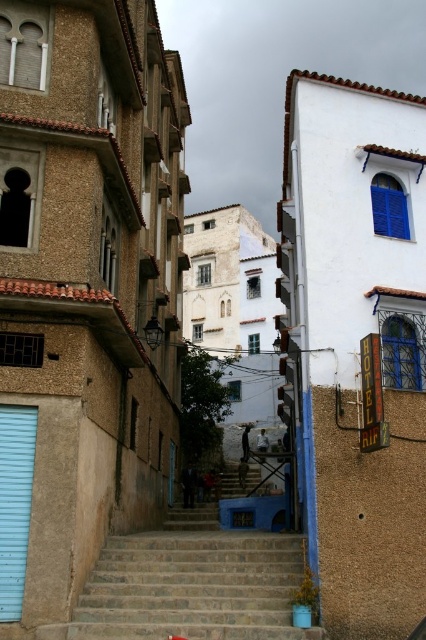
Question: Where is brown stone stairs at center located in relation to light blue matte garage door at lower left in the image?

Choices:
 (A) left
 (B) right

Answer: (B)

Question: Can you confirm if brown stone stairs at center is bigger than light blue matte garage door at lower left?

Choices:
 (A) no
 (B) yes

Answer: (B)

Question: Which object is farther from the camera taking this photo?

Choices:
 (A) brown stone stairs at center
 (B) light blue matte garage door at lower left

Answer: (B)

Question: Can you confirm if brown stone stairs at center is positioned above light blue matte garage door at lower left?

Choices:
 (A) yes
 (B) no

Answer: (B)